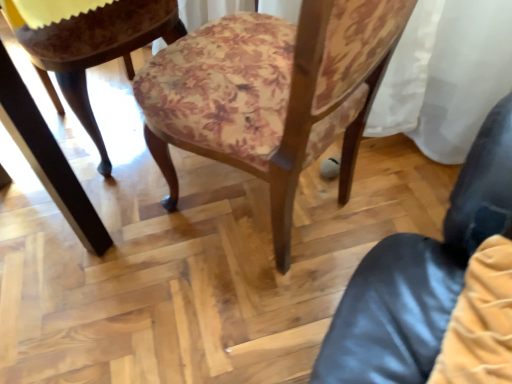
Locate an element on the screen. The width and height of the screenshot is (512, 384). free space underneath floral fabric chair at center (from a real-world perspective) is located at coordinates (260, 211).